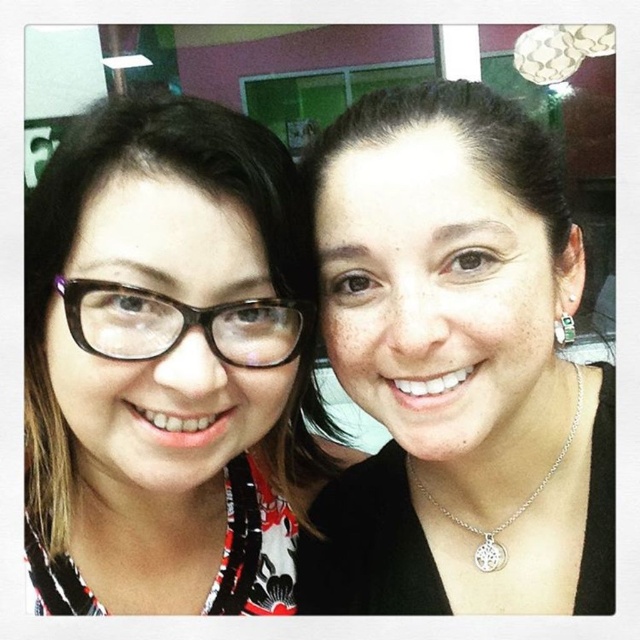
From the picture: Is matte black glasses at left thinner than black plastic glasses at left?

No, matte black glasses at left is not thinner than black plastic glasses at left.

Looking at this image, is matte black glasses at left closer to camera compared to black plastic glasses at left?

Yes.

This screenshot has width=640, height=640. In order to click on matte black glasses at left in this screenshot , I will do click(x=168, y=365).

Is matte black glasses at left further to the viewer compared to silver metallic necklace at center?

No.

Is point (195, 202) more distant than point (540, 483)?

That is False.

Locate an element on the screen. matte black glasses at left is located at coordinates (x=168, y=365).

Does black plastic glasses at left appear over silver metallic necklace at center?

Yes.

Find the location of a particular element. The height and width of the screenshot is (640, 640). black plastic glasses at left is located at coordinates (179, 324).